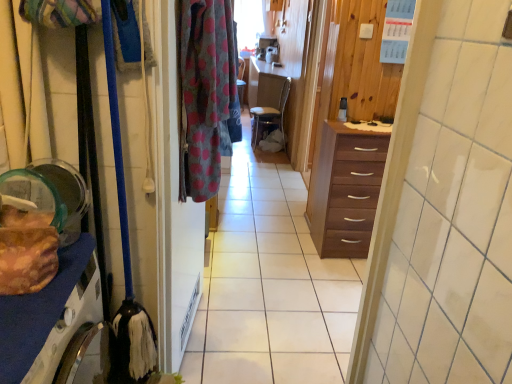
Question: Does polka dot fabric screen door at center have a smaller size compared to matte black coffee cup at center?

Choices:
 (A) no
 (B) yes

Answer: (A)

Question: Is polka dot fabric screen door at center taller than matte black coffee cup at center?

Choices:
 (A) yes
 (B) no

Answer: (A)

Question: Is polka dot fabric screen door at center aimed at matte black coffee cup at center?

Choices:
 (A) no
 (B) yes

Answer: (A)

Question: From the image's perspective, is polka dot fabric screen door at center under matte black coffee cup at center?

Choices:
 (A) no
 (B) yes

Answer: (B)

Question: Is polka dot fabric screen door at center oriented away from matte black coffee cup at center?

Choices:
 (A) yes
 (B) no

Answer: (B)

Question: From their relative heights in the image, would you say brown woven chair at center is taller or shorter than dark brown wood drawer at center, arranged as the 2th cabinetry when viewed from the front?

Choices:
 (A) tall
 (B) short

Answer: (B)

Question: Do you think brown woven chair at center is within dark brown wood drawer at center, arranged as the 2th cabinetry when viewed from the front, or outside of it?

Choices:
 (A) inside
 (B) outside

Answer: (B)

Question: Does point (261, 74) appear closer or farther from the camera than point (325, 228)?

Choices:
 (A) farther
 (B) closer

Answer: (A)

Question: In terms of width, does brown woven chair at center look wider or thinner when compared to dark brown wood drawer at center, arranged as the 2th cabinetry when viewed from the front?

Choices:
 (A) thin
 (B) wide

Answer: (B)

Question: Is point (275, 142) closer or farther from the camera than point (11, 360)?

Choices:
 (A) farther
 (B) closer

Answer: (A)

Question: From the image's perspective, is matte fabric handbag at center above or below brown matte cabinet at left, the first cabinetry in the left-to-right sequence?

Choices:
 (A) above
 (B) below

Answer: (A)

Question: From a real-world perspective, is matte fabric handbag at center physically located above or below brown matte cabinet at left, which is the first cabinetry in front-to-back order?

Choices:
 (A) above
 (B) below

Answer: (B)

Question: Choose the correct answer: Is matte fabric handbag at center inside brown matte cabinet at left, positioned as the 2th cabinetry in right-to-left order, or outside it?

Choices:
 (A) outside
 (B) inside

Answer: (A)

Question: Does point (16, 238) appear closer or farther from the camera than point (386, 129)?

Choices:
 (A) farther
 (B) closer

Answer: (B)

Question: From the image's perspective, relative to white glossy counter top at center, is translucent plastic container at left above or below?

Choices:
 (A) below
 (B) above

Answer: (A)